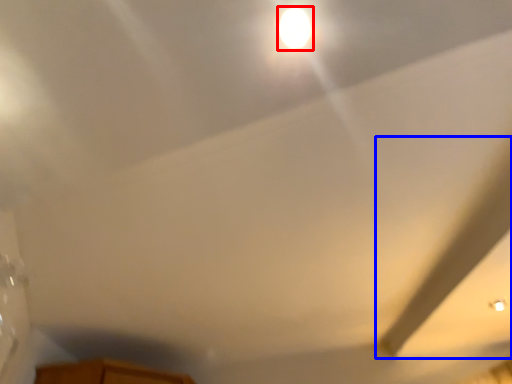
Question: Which of the following is the farthest to the observer, light (highlighted by a red box) or exhaust hood (highlighted by a blue box)?

Choices:
 (A) light
 (B) exhaust hood

Answer: (B)